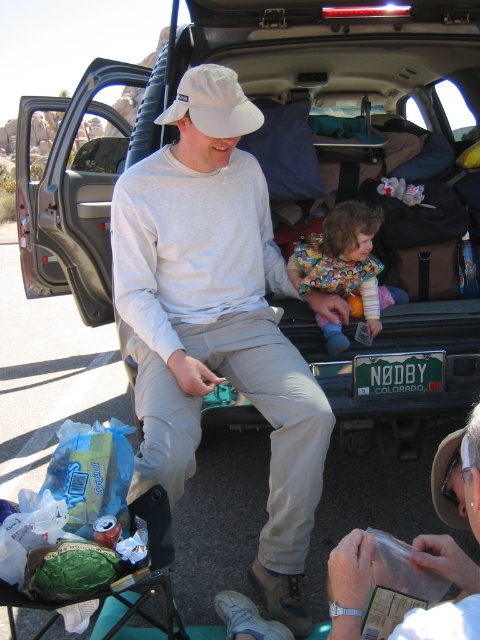
You are standing at the point labeled point (360, 291) and want to walk to the point labeled point (187, 221). Which direction should you face to walk directly towards it?

You should face towards the direction of point (187, 221), which is in front of point (360, 291).

You are a photographer trying to capture a photo of the matte black truck at center and the white matte hat at upper center. Which object should you focus on first if you want to ensure both are in focus, considering their sizes in the frame?

The matte black truck at center is taller than the white matte hat at upper center, so focusing on the larger truck first would help ensure both are in focus.

You are planning to place a new object in the scene. If you want to ensure it fits between the matte black truck at center and the white matte hat at upper center, which object should you consider its size relative to?

You should consider the size relative to the matte black truck at center because it is bigger than the white matte hat at upper center, so the new object must be smaller than the truck to fit between them.